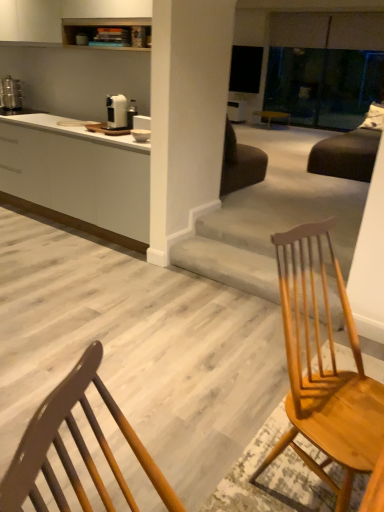
You are a GUI agent. You are given a task and a screenshot of the screen. Output one action in this format:
    pyautogui.click(x=<x>, y=<y>)
    Task: Click on the light brown wood chair at center
    
    Given the screenshot: What is the action you would take?
    pyautogui.click(x=324, y=372)

What is the approximate width of light brown wood chair at center?

21.47 inches.

At what (x,y) coordinates should I click in order to perform the action: click on white matte cabinet at left. Please return your answer as a coordinate pair (x, y). The image size is (384, 512). Looking at the image, I should click on (77, 176).

You are a GUI agent. You are given a task and a screenshot of the screen. Output one action in this format:
    pyautogui.click(x=<x>, y=<y>)
    Task: Click on the light brown wood chair at center
    
    Given the screenshot: What is the action you would take?
    pyautogui.click(x=324, y=372)

From the image's perspective, who appears lower, white matte cabinet at left or light brown wood chair at center?

light brown wood chair at center.

Would you say white matte cabinet at left is to the left or to the right of light brown wood chair at center in the picture?

From the image, it's evident that white matte cabinet at left is to the left of light brown wood chair at center.

Where is `cabinetry above the light brown wood chair at center (from the image's perspective)`? The width and height of the screenshot is (384, 512). cabinetry above the light brown wood chair at center (from the image's perspective) is located at coordinates (77, 176).

Which is behind, white matte cabinet at left or light brown wood chair at center?

white matte cabinet at left.

Is point (12, 85) positioned before point (324, 473)?

No, it is behind (324, 473).

The height and width of the screenshot is (512, 384). What are the coordinates of `the 2nd appliance to the left of the light brown wood chair at center, starting your count from the anchor` in the screenshot? It's located at (11, 93).

Is metallic silver toaster at left, marked as the second appliance in a bottom-to-top arrangement, positioned with its back to light brown wood chair at center?

metallic silver toaster at left, marked as the second appliance in a bottom-to-top arrangement, is not turned away from light brown wood chair at center.

From the picture: From a real-world perspective, which is physically below, metallic silver toaster at left, which is the first appliance from left to right, or satin silver toaster at upper center, placed as the 2th appliance when sorted from left to right?

satin silver toaster at upper center, placed as the 2th appliance when sorted from left to right, from a real-world perspective.

Which of these two, metallic silver toaster at left, which is the first appliance from left to right, or satin silver toaster at upper center, which is the first appliance from bottom to top, is smaller?

With smaller size is satin silver toaster at upper center, which is the first appliance from bottom to top.

From the image's perspective, does metallic silver toaster at left, marked as the second appliance in a right-to-left arrangement, appear higher than satin silver toaster at upper center, which is the first appliance from bottom to top?

Yes, from the image's perspective, metallic silver toaster at left, marked as the second appliance in a right-to-left arrangement, is above satin silver toaster at upper center, which is the first appliance from bottom to top.

How many degrees apart are the facing directions of metallic silver toaster at left, the 1th appliance viewed from the top, and satin silver toaster at upper center, the second appliance viewed from the top?

The angle between the facing direction of metallic silver toaster at left, the 1th appliance viewed from the top, and the facing direction of satin silver toaster at upper center, the second appliance viewed from the top, is 0.00303 degrees.

Based on their sizes in the image, would you say white matte cabinet at left is bigger or smaller than satin silver toaster at upper center, the second appliance viewed from the top?

white matte cabinet at left is bigger than satin silver toaster at upper center, the second appliance viewed from the top.

In the image, there is a satin silver toaster at upper center, the second appliance viewed from the top. At what (x,y) coordinates should I click in order to perform the action: click on cabinetry below it (from the image's perspective). Please return your answer as a coordinate pair (x, y). The image size is (384, 512). Looking at the image, I should click on (77, 176).

Does white matte cabinet at left come behind satin silver toaster at upper center, the 2th appliance from the back?

No, white matte cabinet at left is closer to the viewer.

Based on the photo, from a real-world perspective, is white matte cabinet at left below satin silver toaster at upper center, which is the first appliance from bottom to top?

Indeed, from a real-world perspective, white matte cabinet at left is positioned beneath satin silver toaster at upper center, which is the first appliance from bottom to top.

Looking at this image, considering the relative sizes of metallic silver toaster at left, marked as the second appliance in a bottom-to-top arrangement, and white matte cabinet at left in the image provided, is metallic silver toaster at left, marked as the second appliance in a bottom-to-top arrangement, wider than white matte cabinet at left?

→ No.

This screenshot has height=512, width=384. Find the location of `appliance that is the 2nd one above the white matte cabinet at left (from a real-world perspective)`. appliance that is the 2nd one above the white matte cabinet at left (from a real-world perspective) is located at coordinates (11, 93).

From the image's perspective, is metallic silver toaster at left, the 1th appliance viewed from the top, over white matte cabinet at left?

Indeed, from the image's perspective, metallic silver toaster at left, the 1th appliance viewed from the top, is shown above white matte cabinet at left.

Between metallic silver toaster at left, the 1th appliance viewed from the top, and white matte cabinet at left, which one has more height?

white matte cabinet at left.

From a real-world perspective, who is located lower, light brown wood chair at center or white matte cabinet at left?

From a 3D spatial view, white matte cabinet at left is below.

Is light brown wood chair at center completely or partially outside of white matte cabinet at left?

Yes, light brown wood chair at center is outside of white matte cabinet at left.

Based on the photo, considering the relative positions of light brown wood chair at center and white matte cabinet at left in the image provided, is light brown wood chair at center to the left of white matte cabinet at left from the viewer's perspective?

In fact, light brown wood chair at center is to the right of white matte cabinet at left.

Which object is thinner, light brown wood chair at center or white matte cabinet at left?

Thinner between the two is light brown wood chair at center.

Is satin silver toaster at upper center, the second appliance viewed from the top, facing towards white matte cabinet at left?

No.

Is satin silver toaster at upper center, the second appliance viewed from the top, positioned beyond the bounds of white matte cabinet at left?

That's correct, satin silver toaster at upper center, the second appliance viewed from the top, is outside of white matte cabinet at left.

Find the location of `cabinetry that is below the satin silver toaster at upper center, which is the first appliance from bottom to top (from the image's perspective)`. cabinetry that is below the satin silver toaster at upper center, which is the first appliance from bottom to top (from the image's perspective) is located at coordinates (77, 176).

I want to click on cabinetry behind the light brown wood chair at center, so (x=77, y=176).

Identify the location of the 2nd appliance above the light brown wood chair at center (from a real-world perspective). The image size is (384, 512). (11, 93).

Based on their spatial positions, is light brown wood chair at center or satin silver toaster at upper center, the 2th appliance from the back, further from white matte cabinet at left?

Based on the image, light brown wood chair at center appears to be further to white matte cabinet at left.

Looking at the image, which one is located closer to white matte cabinet at left, light brown wood chair at center or metallic silver toaster at left, the 1th appliance viewed from the top?

Based on the image, metallic silver toaster at left, the 1th appliance viewed from the top, appears to be nearer to white matte cabinet at left.

Estimate the real-world distances between objects in this image. Which object is closer to white matte cabinet at left, metallic silver toaster at left, marked as the second appliance in a right-to-left arrangement, or satin silver toaster at upper center, placed as the 2th appliance when sorted from left to right?

satin silver toaster at upper center, placed as the 2th appliance when sorted from left to right.

Based on their spatial positions, is metallic silver toaster at left, arranged as the 2th appliance when viewed from the front, or white matte cabinet at left further from satin silver toaster at upper center, the 2th appliance from the back?

metallic silver toaster at left, arranged as the 2th appliance when viewed from the front, is further to satin silver toaster at upper center, the 2th appliance from the back.

Considering their positions, is white matte cabinet at left positioned further to metallic silver toaster at left, arranged as the 2th appliance when viewed from the front, than satin silver toaster at upper center, which is the first appliance from bottom to top?

satin silver toaster at upper center, which is the first appliance from bottom to top, lies further to metallic silver toaster at left, arranged as the 2th appliance when viewed from the front, than the other object.

Which object lies further to the anchor point white matte cabinet at left, satin silver toaster at upper center, the 2th appliance from the back, or light brown wood chair at center?

Among the two, light brown wood chair at center is located further to white matte cabinet at left.

When comparing their distances from metallic silver toaster at left, which is the first appliance from left to right, does satin silver toaster at upper center, which is the first appliance in right-to-left order, or light brown wood chair at center seem closer?

satin silver toaster at upper center, which is the first appliance in right-to-left order, lies closer to metallic silver toaster at left, which is the first appliance from left to right, than the other object.

Based on their spatial positions, is white matte cabinet at left or metallic silver toaster at left, arranged as the 2th appliance when viewed from the front, further from satin silver toaster at upper center, which is the first appliance from bottom to top?

metallic silver toaster at left, arranged as the 2th appliance when viewed from the front, is further to satin silver toaster at upper center, which is the first appliance from bottom to top.

Locate an element on the screen. This screenshot has width=384, height=512. cabinetry between metallic silver toaster at left, the 1th appliance viewed from the top, and satin silver toaster at upper center, the second appliance viewed from the top, in the horizontal direction is located at coordinates (77, 176).

You are a GUI agent. You are given a task and a screenshot of the screen. Output one action in this format:
    pyautogui.click(x=<x>, y=<y>)
    Task: Click on the cabinetry between light brown wood chair at center and metallic silver toaster at left, marked as the second appliance in a right-to-left arrangement, from front to back
    
    Given the screenshot: What is the action you would take?
    [x=77, y=176]

Where is `appliance between light brown wood chair at center and metallic silver toaster at left, marked as the second appliance in a bottom-to-top arrangement, along the z-axis`? appliance between light brown wood chair at center and metallic silver toaster at left, marked as the second appliance in a bottom-to-top arrangement, along the z-axis is located at coordinates (116, 112).

I want to click on cabinetry between light brown wood chair at center and satin silver toaster at upper center, which is the first appliance in right-to-left order, along the z-axis, so click(77, 176).